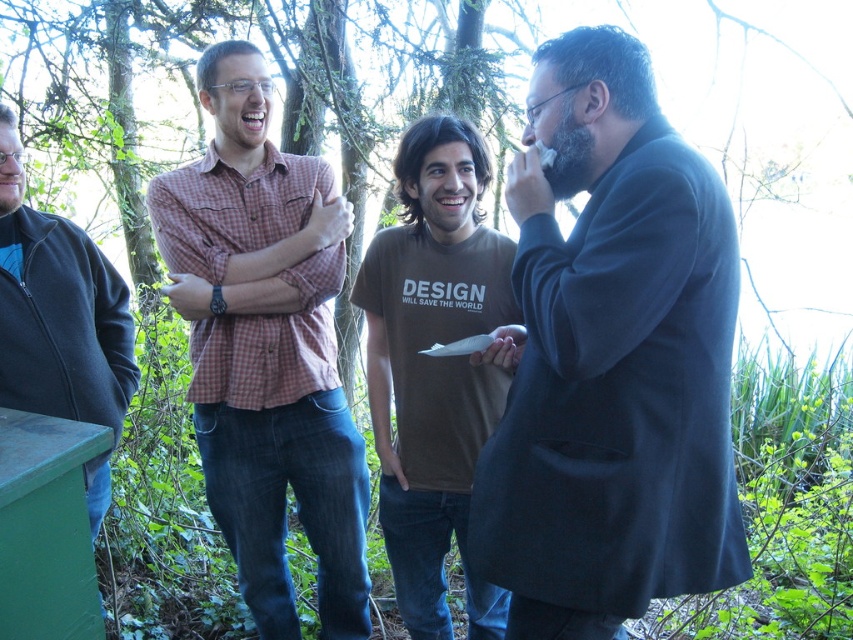
Question: Which object is farther from the camera taking this photo?

Choices:
 (A) brown cotton t-shirt at center
 (B) checkered fabric shirt at center

Answer: (B)

Question: Is dark blue suit at right to the left of brown cotton t-shirt at center from the viewer's perspective?

Choices:
 (A) yes
 (B) no

Answer: (B)

Question: Is dark blue suit at right further to the viewer compared to brown cotton t-shirt at center?

Choices:
 (A) yes
 (B) no

Answer: (B)

Question: Observing the image, what is the correct spatial positioning of checkered fabric shirt at center in reference to brown cotton t-shirt at center?

Choices:
 (A) below
 (B) above

Answer: (B)

Question: Which is farther from the brown cotton t-shirt at center?

Choices:
 (A) checkered fabric shirt at center
 (B) dark blue suit at right

Answer: (B)

Question: Which point is farther from the camera taking this photo?

Choices:
 (A) (426, 225)
 (B) (74, 292)
 (C) (677, 141)

Answer: (A)